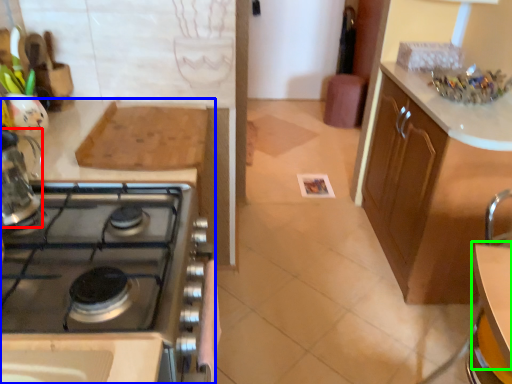
Question: Which object is the farthest from kitchen appliance (highlighted by a red box)? Choose among these: cabinetry (highlighted by a blue box) or table (highlighted by a green box).

Choices:
 (A) cabinetry
 (B) table

Answer: (B)